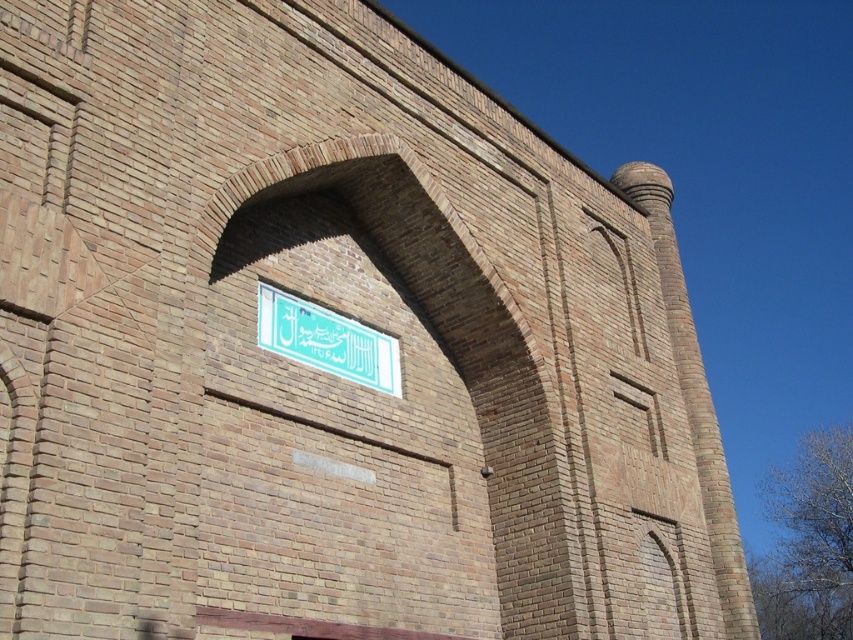
Does point (519, 417) come closer to viewer compared to point (352, 380)?

No, it is behind (352, 380).

Which is more to the right, brown brick archway at center or white glossy sign at center?

brown brick archway at center

The image size is (853, 640). In order to click on brown brick archway at center in this screenshot , I will do `click(450, 346)`.